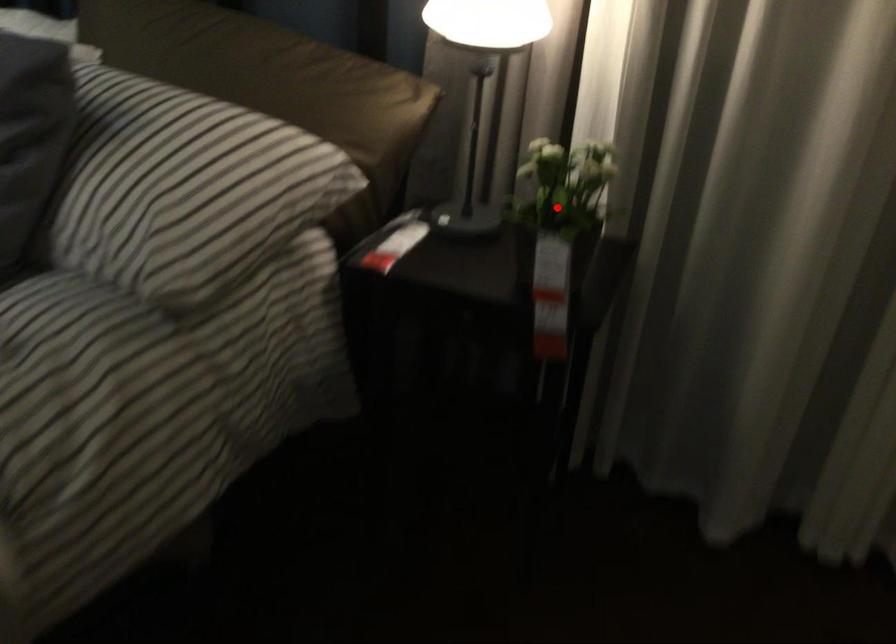
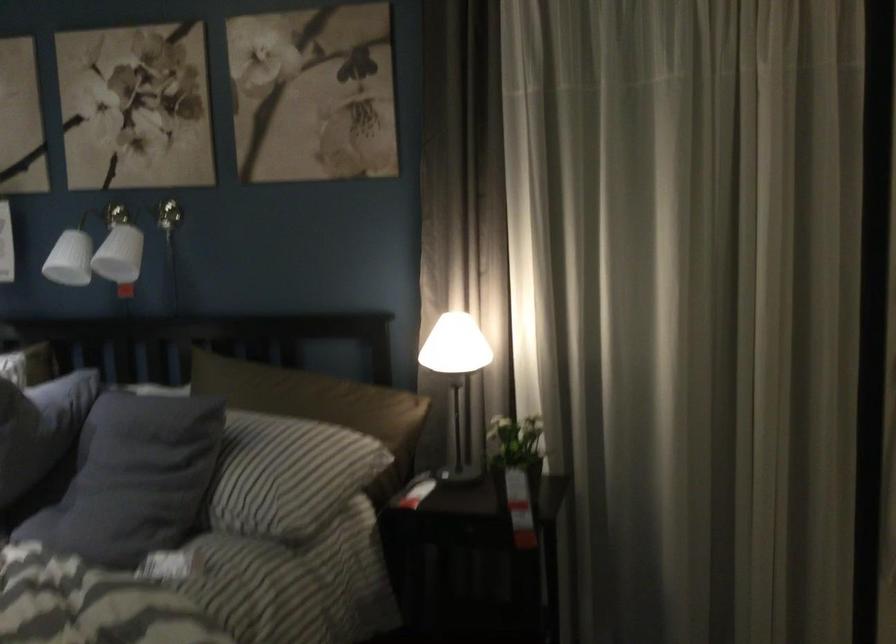
Question: A red point is marked in image1. In image2, is the corresponding 3D point closer to the camera or farther? Reply with the corresponding letter.

Choices:
 (A) The corresponding 3D point is closer.
 (B) The corresponding 3D point is farther.

Answer: (B)